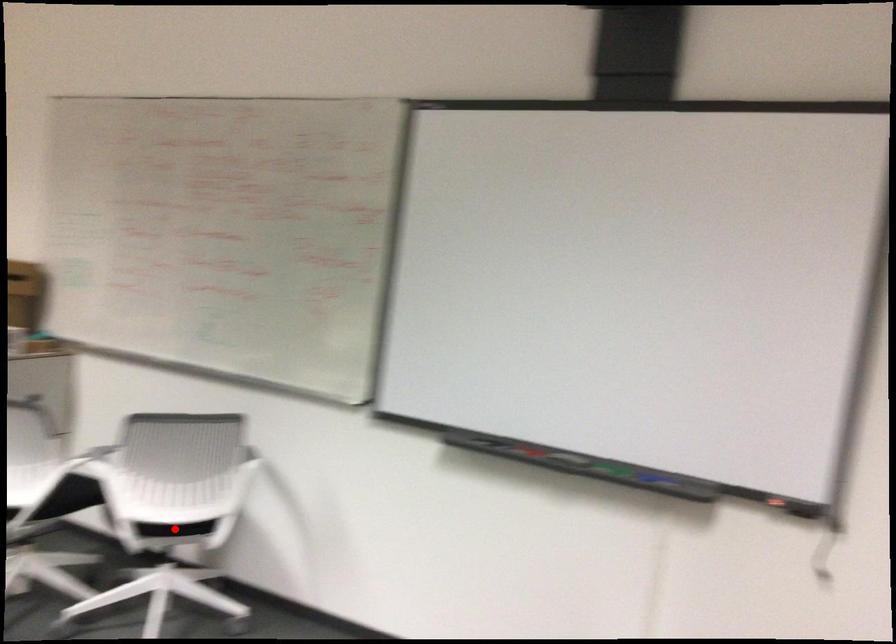
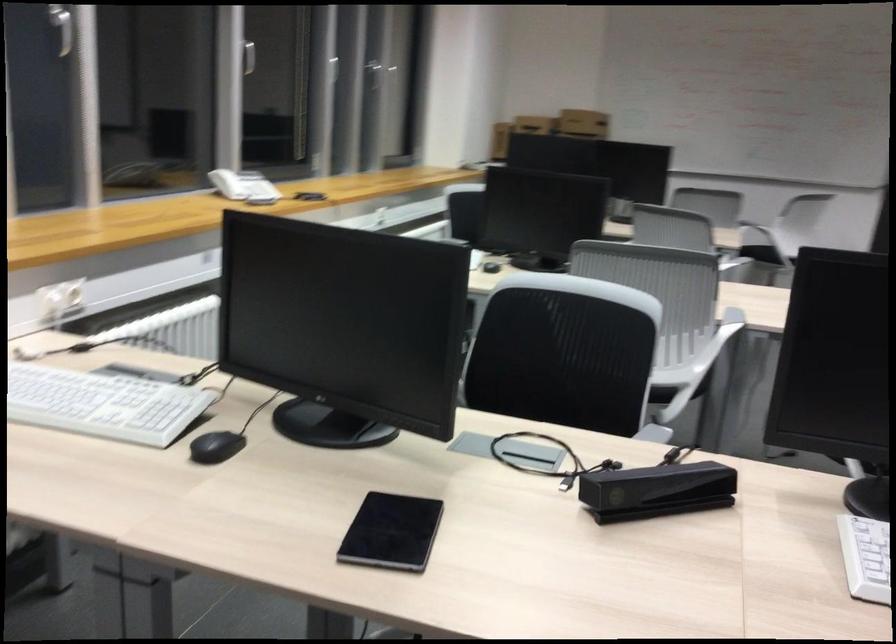
Question: I am providing you with two images of the same scene from different viewpoints. A red point is marked on the first image. Can you still see the location of the red point in image 2?

Choices:
 (A) Yes
 (B) No

Answer: (B)